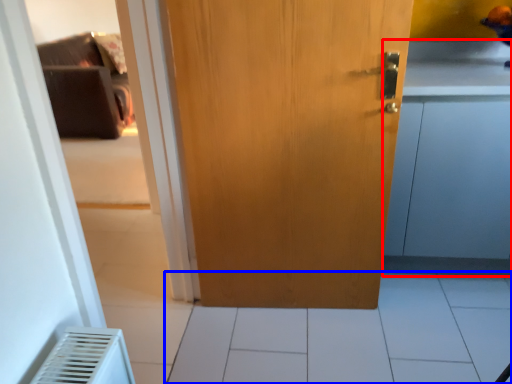
Question: Which object is closer to the camera taking this photo, cabinetry (highlighted by a red box) or tile (highlighted by a blue box)?

Choices:
 (A) cabinetry
 (B) tile

Answer: (B)